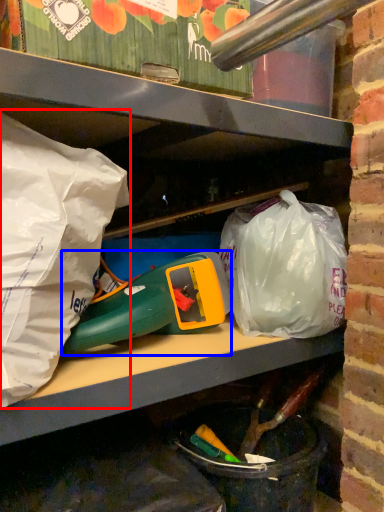
Question: Which point is closer to the camera, plastic bag (highlighted by a red box) or toy (highlighted by a blue box)?

Choices:
 (A) plastic bag
 (B) toy

Answer: (A)